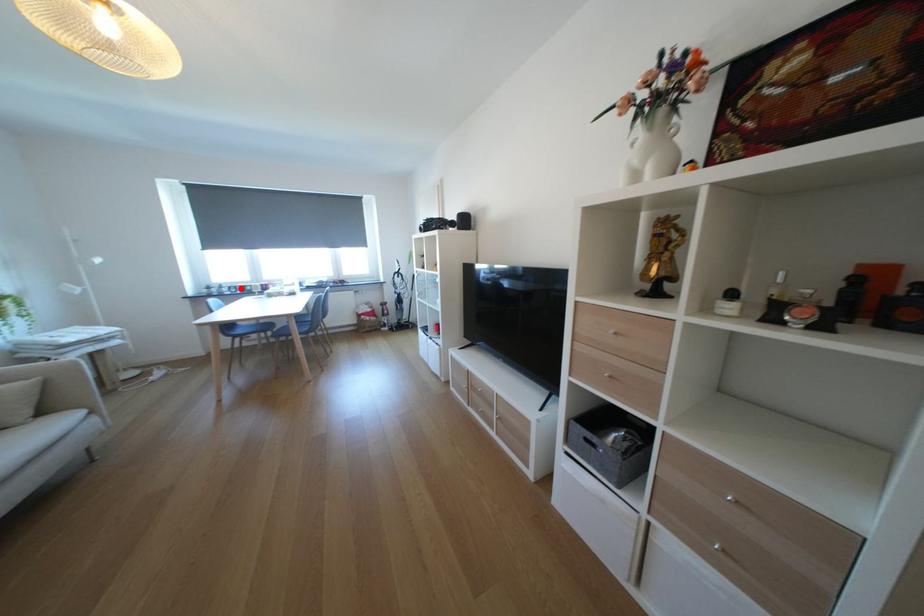
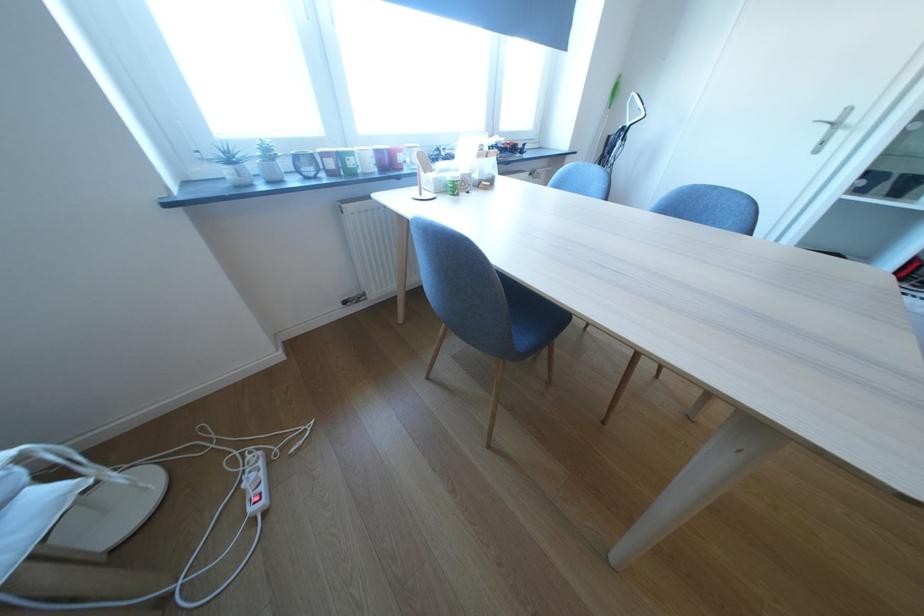
In the second image, find the point that corresponds to the highlighted location in the first image.

(308, 160)